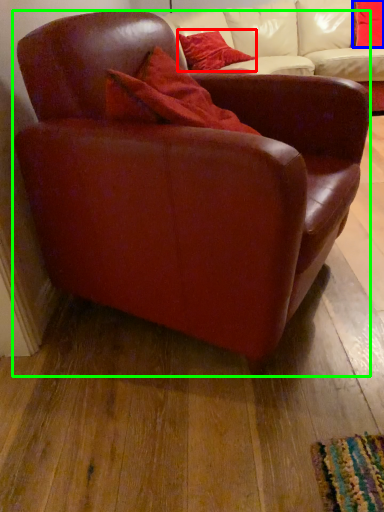
Question: Based on their relative distances, which object is farther from pillow (highlighted by a red box)? Choose from pillow (highlighted by a blue box) and chair (highlighted by a green box).

Choices:
 (A) pillow
 (B) chair

Answer: (B)